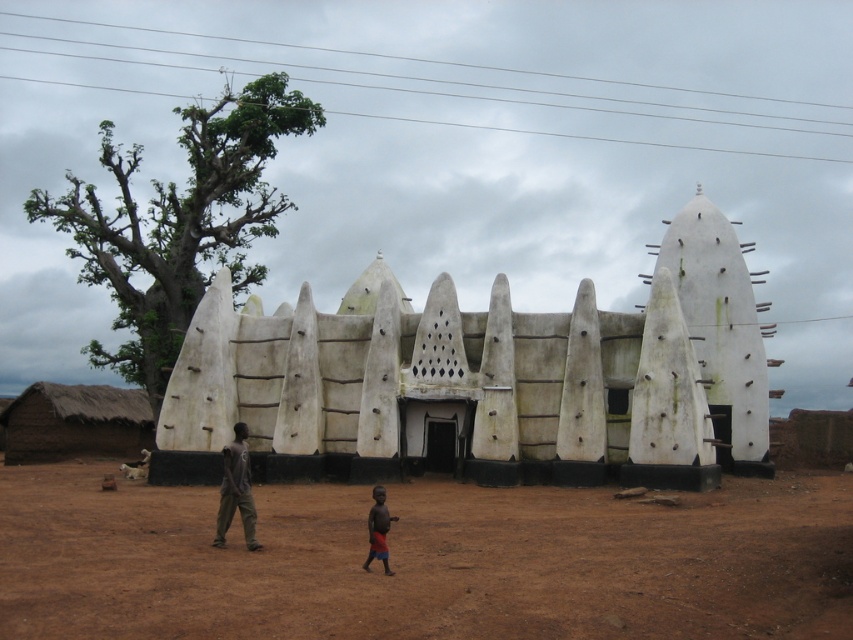
Is white mud building at center taller than brown thatch hut at lower left?

Indeed, white mud building at center has a greater height compared to brown thatch hut at lower left.

Measure the distance from white mud building at center to brown thatch hut at lower left.

white mud building at center is 155.44 feet from brown thatch hut at lower left.

In order to click on white mud building at center in this screenshot , I will do click(x=486, y=378).

Is point (239, 580) positioned before point (386, 570)?

Yes, it is in front of point (386, 570).

Describe the element at coordinates (422, 561) in the screenshot. This screenshot has width=853, height=640. I see `brown dirt field at center` at that location.

I want to click on brown dirt field at center, so click(x=422, y=561).

Who is more distant from viewer, (28, 572) or (99, 406)?

Positioned behind is point (99, 406).

Based on the photo, is brown dirt field at center above brown thatch hut at lower left?

Actually, brown dirt field at center is below brown thatch hut at lower left.

Where is `brown dirt field at center`? Image resolution: width=853 pixels, height=640 pixels. brown dirt field at center is located at coordinates (422, 561).